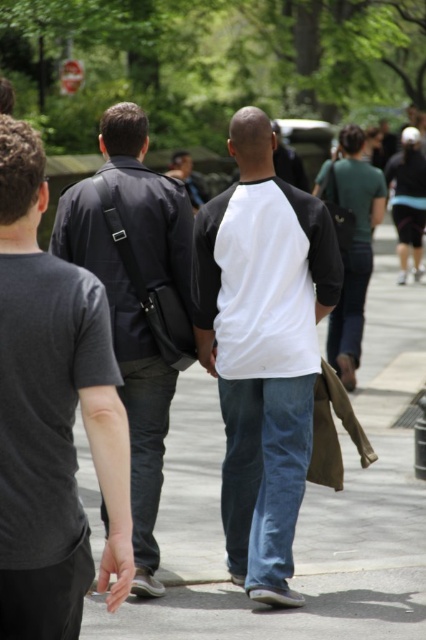
Question: In this image, where is white jersey at center located relative to dark gray fabric jacket at center?

Choices:
 (A) below
 (B) above

Answer: (A)

Question: Among these points, which one is nearest to the camera?

Choices:
 (A) [x=367, y=385]
 (B) [x=288, y=230]
 (C) [x=86, y=214]
 (D) [x=115, y=460]

Answer: (D)

Question: Can you confirm if blue jeans at center is positioned to the right of dark gray cotton shirt at left?

Choices:
 (A) yes
 (B) no

Answer: (A)

Question: Which object is closer to the camera taking this photo?

Choices:
 (A) dark gray fabric jacket at center
 (B) blue jeans at center
 (C) dark gray cotton shirt at left
 (D) white jersey at center

Answer: (C)

Question: Which of the following is the closest to the observer?

Choices:
 (A) dark gray fabric jacket at center
 (B) blue jeans at center

Answer: (B)

Question: Does blue jeans at center lie behind dark gray fabric jacket at center?

Choices:
 (A) no
 (B) yes

Answer: (A)